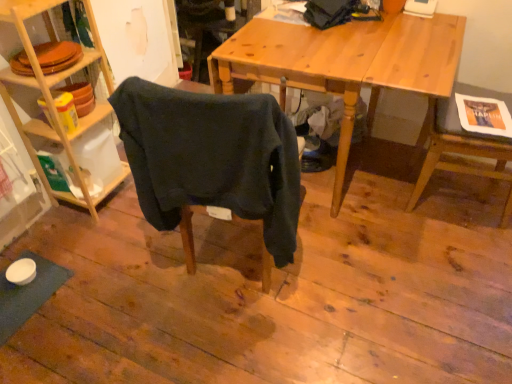
What are the coordinates of `free region under wooden chair at right, placed as the second chair when sorted from left to right (from a real-world perspective)` in the screenshot? It's located at (471, 197).